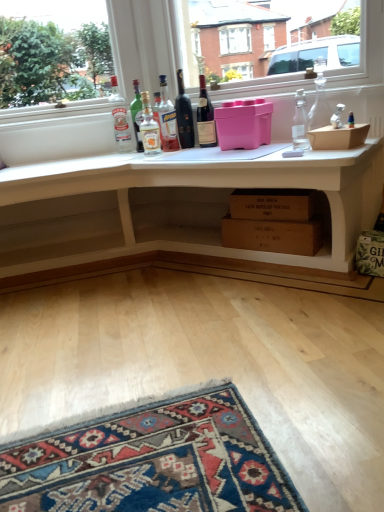
Question: Is dark red glass wine bottle at center, placed as the 5th bottle when sorted from left to right, touching clear glass decanter at upper right, which is counted as the seventh bottle, starting from the left?

Choices:
 (A) yes
 (B) no

Answer: (B)

Question: Is dark red glass wine bottle at center, placed as the 5th bottle when sorted from left to right, facing towards clear glass decanter at upper right, the first bottle viewed from the right?

Choices:
 (A) yes
 (B) no

Answer: (B)

Question: Does dark red glass wine bottle at center, placed as the 5th bottle when sorted from left to right, have a smaller size compared to clear glass decanter at upper right, which is counted as the seventh bottle, starting from the left?

Choices:
 (A) yes
 (B) no

Answer: (A)

Question: Is dark red glass wine bottle at center, the third bottle when ordered from right to left, oriented away from clear glass decanter at upper right, which is counted as the seventh bottle, starting from the left?

Choices:
 (A) yes
 (B) no

Answer: (B)

Question: Can you confirm if dark red glass wine bottle at center, the third bottle when ordered from right to left, is bigger than clear glass decanter at upper right, the first bottle viewed from the right?

Choices:
 (A) yes
 (B) no

Answer: (B)

Question: Considering the positions of point (203, 117) and point (306, 117), is point (203, 117) closer or farther from the camera than point (306, 117)?

Choices:
 (A) farther
 (B) closer

Answer: (A)

Question: Is dark red glass wine bottle at center, the third bottle when ordered from right to left, to the left or to the right of clear glass bottle at upper right, arranged as the 2th bottle when viewed from the right, in the image?

Choices:
 (A) right
 (B) left

Answer: (B)

Question: In the image, is dark red glass wine bottle at center, placed as the 5th bottle when sorted from left to right, positioned in front of or behind clear glass bottle at upper right, arranged as the 2th bottle when viewed from the right?

Choices:
 (A) front
 (B) behind

Answer: (B)

Question: Considering the positions of dark red glass wine bottle at center, the third bottle when ordered from right to left, and clear glass bottle at upper right, which ranks as the 6th bottle in left-to-right order, in the image, is dark red glass wine bottle at center, the third bottle when ordered from right to left, taller or shorter than clear glass bottle at upper right, which ranks as the 6th bottle in left-to-right order,?

Choices:
 (A) tall
 (B) short

Answer: (A)

Question: Is point (160, 96) positioned closer to the camera than point (203, 98)?

Choices:
 (A) closer
 (B) farther

Answer: (B)

Question: From the image's perspective, is translucent glass bottle at center, which is counted as the 3th bottle, starting from the left, above or below dark red glass wine bottle at center, the third bottle when ordered from right to left?

Choices:
 (A) above
 (B) below

Answer: (B)

Question: Would you say translucent glass bottle at center, which is counted as the 3th bottle, starting from the left, is inside or outside dark red glass wine bottle at center, placed as the 5th bottle when sorted from left to right?

Choices:
 (A) inside
 (B) outside

Answer: (B)

Question: Considering the positions of translucent glass bottle at center, positioned as the fifth bottle in right-to-left order, and dark red glass wine bottle at center, the third bottle when ordered from right to left, in the image, is translucent glass bottle at center, positioned as the fifth bottle in right-to-left order, taller or shorter than dark red glass wine bottle at center, the third bottle when ordered from right to left,?

Choices:
 (A) tall
 (B) short

Answer: (A)

Question: Choose the correct answer: Is pink plastic container at center, which ranks as the 1th box in top-to-bottom order, inside translucent glass bottle at center, which ranks as the 6th bottle in right-to-left order, or outside it?

Choices:
 (A) outside
 (B) inside

Answer: (A)

Question: From a real-world perspective, is pink plastic container at center, which ranks as the 1th box in top-to-bottom order, above or below translucent glass bottle at center, which ranks as the second bottle in left-to-right order?

Choices:
 (A) below
 (B) above

Answer: (A)